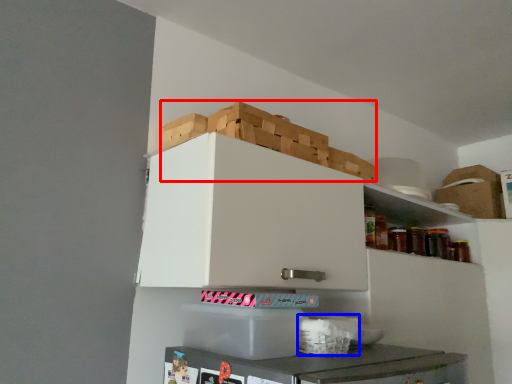
Question: Which object appears closest to the camera in this image, crate (highlighted by a red box) or basket (highlighted by a blue box)?

Choices:
 (A) crate
 (B) basket

Answer: (B)